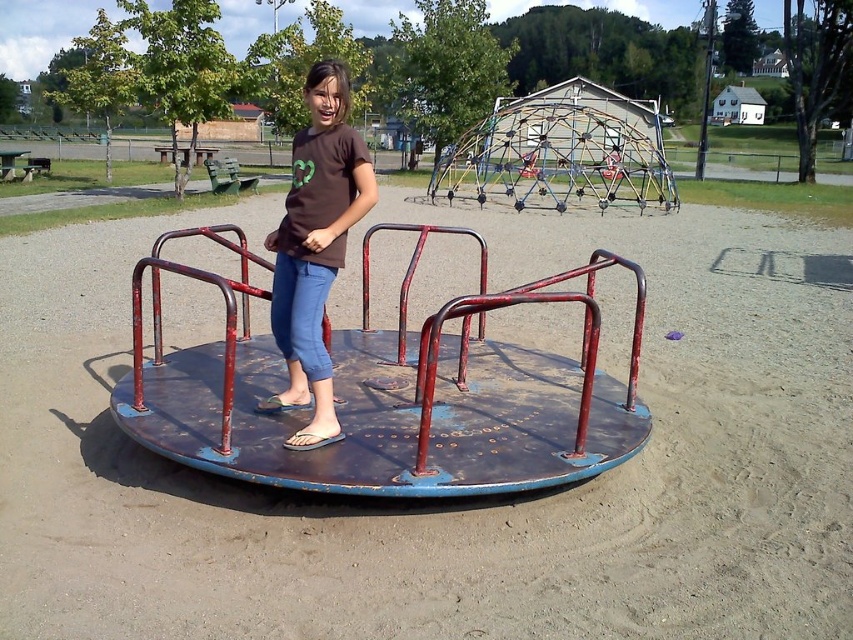
Question: Is rusty metal carousel at center to the right of brown matte shirt at center from the viewer's perspective?

Choices:
 (A) yes
 (B) no

Answer: (A)

Question: Among these points, which one is nearest to the camera?

Choices:
 (A) (326, 176)
 (B) (173, 355)

Answer: (A)

Question: Does rusty metal carousel at center appear on the left side of brown matte shirt at center?

Choices:
 (A) no
 (B) yes

Answer: (A)

Question: Which point is closer to the camera taking this photo?

Choices:
 (A) 329,384
 (B) 590,435

Answer: (A)

Question: Is rusty metal carousel at center wider than brown matte shirt at center?

Choices:
 (A) no
 (B) yes

Answer: (B)

Question: Which of the following is the farthest from the observer?

Choices:
 (A) (200, 419)
 (B) (346, 211)

Answer: (A)